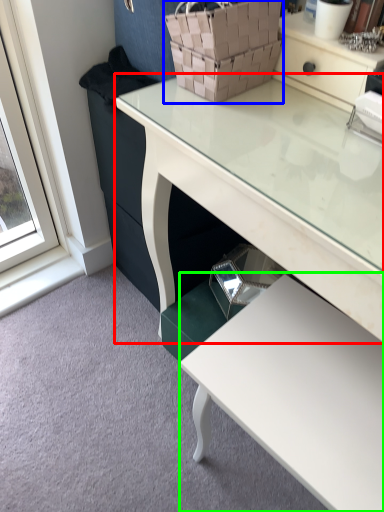
Question: Which object is positioned farthest from desk (highlighted by a red box)? Select from basket (highlighted by a blue box) and table (highlighted by a green box).

Choices:
 (A) basket
 (B) table

Answer: (B)